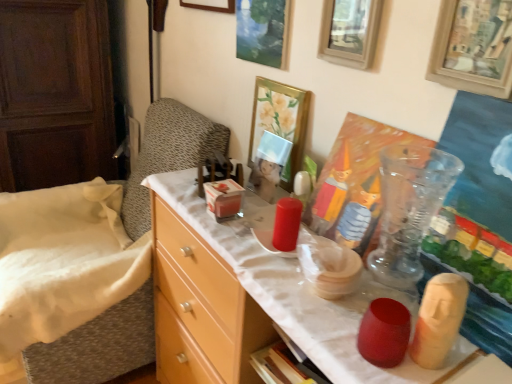
Question: Could you tell me if light wood dresser at left is facing light wood dresser at left?

Choices:
 (A) yes
 (B) no

Answer: (A)

Question: Is light wood dresser at left in contact with light wood dresser at left?

Choices:
 (A) yes
 (B) no

Answer: (B)

Question: From the image's perspective, is light wood dresser at left beneath light wood dresser at left?

Choices:
 (A) yes
 (B) no

Answer: (B)

Question: Can you confirm if light wood dresser at left is shorter than light wood dresser at left?

Choices:
 (A) yes
 (B) no

Answer: (B)

Question: Does light wood dresser at left come in front of light wood dresser at left?

Choices:
 (A) no
 (B) yes

Answer: (A)

Question: From the image's perspective, relative to wooden picture frame at upper right, arranged as the first picture frame when viewed from the right, is white fabric bedsheet at left above or below?

Choices:
 (A) above
 (B) below

Answer: (B)

Question: Is white fabric bedsheet at left bigger or smaller than wooden picture frame at upper right, the fifth picture frame positioned from the left?

Choices:
 (A) small
 (B) big

Answer: (B)

Question: From a real-world perspective, is white fabric bedsheet at left above or below wooden picture frame at upper right, the fifth picture frame positioned from the left?

Choices:
 (A) below
 (B) above

Answer: (A)

Question: Does point (53, 233) appear closer or farther from the camera than point (463, 26)?

Choices:
 (A) closer
 (B) farther

Answer: (B)

Question: Looking at their shapes, would you say light wood dresser at left is wider or thinner than wooden picture frame at upper center, the 4th picture frame from the left?

Choices:
 (A) thin
 (B) wide

Answer: (B)

Question: Is light wood dresser at left bigger or smaller than wooden picture frame at upper center, the 4th picture frame from the left?

Choices:
 (A) small
 (B) big

Answer: (B)

Question: From the image's perspective, relative to wooden picture frame at upper center, the 4th picture frame from the left, is light wood dresser at left above or below?

Choices:
 (A) below
 (B) above

Answer: (A)

Question: Is light wood dresser at left inside or outside of wooden picture frame at upper center, the 4th picture frame from the left?

Choices:
 (A) inside
 (B) outside

Answer: (B)

Question: In terms of size, does light wood dresser at left appear bigger or smaller than white fabric bedsheet at left?

Choices:
 (A) big
 (B) small

Answer: (A)

Question: From the image's perspective, is light wood dresser at left located above or below white fabric bedsheet at left?

Choices:
 (A) above
 (B) below

Answer: (A)